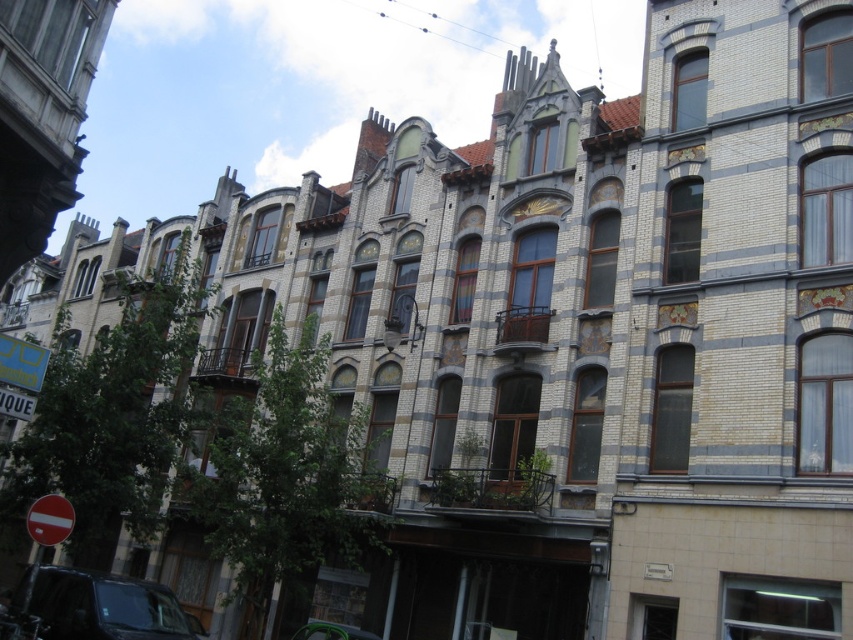
Question: Does shiny black car at lower left appear under red plastic sign at lower left?

Choices:
 (A) no
 (B) yes

Answer: (B)

Question: From the image, what is the correct spatial relationship of red plastic sign at lower left in relation to metallic silver car at lower center?

Choices:
 (A) left
 (B) right

Answer: (A)

Question: Which object appears farthest from the camera in this image?

Choices:
 (A) metallic silver car at lower center
 (B) red plastic sign at lower left
 (C) shiny black car at lower left

Answer: (A)

Question: Does shiny black car at lower left appear under metallic silver car at lower center?

Choices:
 (A) no
 (B) yes

Answer: (B)

Question: Which of the following is the farthest from the observer?

Choices:
 (A) metallic silver car at lower center
 (B) shiny black car at lower left

Answer: (A)

Question: Among these objects, which one is nearest to the camera?

Choices:
 (A) red plastic sign at lower left
 (B) shiny black car at lower left

Answer: (A)